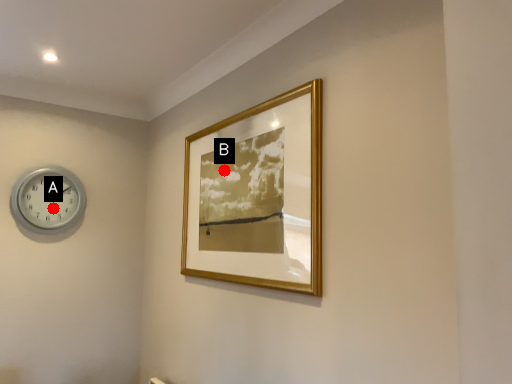
Question: Two points are circled on the image, labeled by A and B beside each circle. Which point is closer to the camera?

Choices:
 (A) A is closer
 (B) B is closer

Answer: (B)